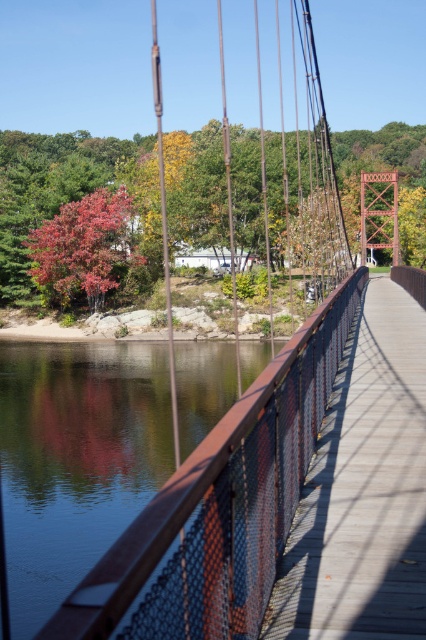
Is wooden bridge at center positioned at the back of vivid red leaves at left?

No.

Describe the element at coordinates (362, 490) in the screenshot. I see `wooden bridge at center` at that location.

Locate an element on the screen. wooden bridge at center is located at coordinates (362, 490).

Is point (152, 220) closer to viewer compared to point (126, 200)?

That is True.

Can you confirm if reddish-brown bark tree at left is positioned to the right of vivid red leaves at left?

Correct, you'll find reddish-brown bark tree at left to the right of vivid red leaves at left.

The image size is (426, 640). In order to click on reddish-brown bark tree at left in this screenshot , I will do `click(69, 195)`.

This screenshot has width=426, height=640. Describe the element at coordinates (74, 460) in the screenshot. I see `glossy water at center` at that location.

Is glossy water at center below vivid red leaves at left?

Yes, glossy water at center is below vivid red leaves at left.

Image resolution: width=426 pixels, height=640 pixels. Find the location of `glossy water at center`. glossy water at center is located at coordinates (74, 460).